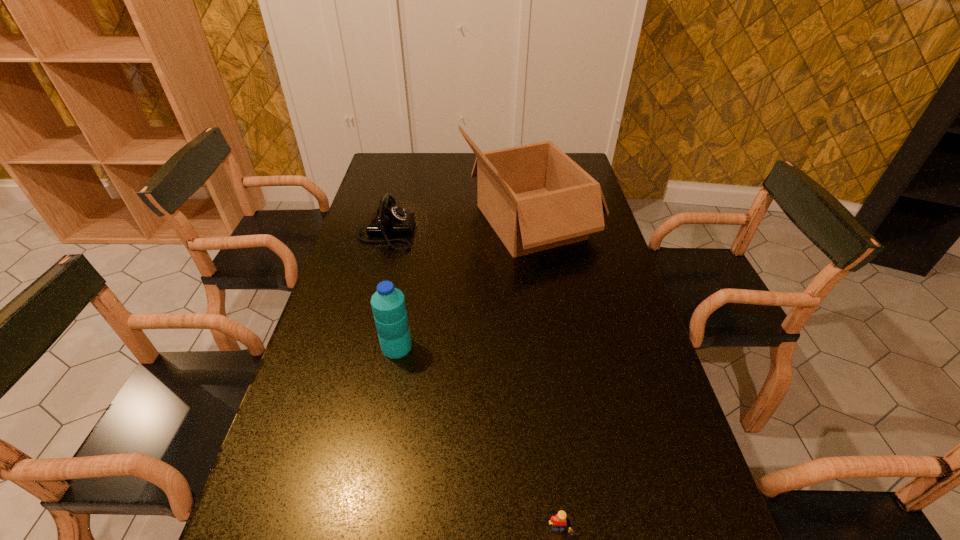
In the image, there is a desktop. Where is `blank space at the left edge`? blank space at the left edge is located at coordinates (349, 353).

Identify the location of vacant space at the right edge of the desktop. This screenshot has height=540, width=960. (662, 379).

At what (x,y) coordinates should I click in order to perform the action: click on vacant space at the far left corner of the desktop. Please return your answer as a coordinate pair (x, y). Looking at the image, I should click on point(406,156).

Identify the location of unoccupied position between the tallest object and the telephone. (458, 227).

Find the location of a particular element. The height and width of the screenshot is (540, 960). free space between the second shortest object and the box is located at coordinates (458, 227).

Find the location of a particular element. The image size is (960, 540). free area in between the tallest object and the second tallest object is located at coordinates (464, 284).

Locate an element on the screen. free space between the tallest object and the second nearest object is located at coordinates (464, 284).

Locate an element on the screen. The height and width of the screenshot is (540, 960). object that is the second closest one to the nearest object is located at coordinates (535, 197).

Locate which object ranks third in proximity to the box. Please provide its 2D coordinates. Your answer should be formatted as a tuple, i.e. [(x, y)], where the tuple contains the x and y coordinates of a point satisfying the conditions above.

[(559, 521)]

The width and height of the screenshot is (960, 540). In order to click on free location that satisfies the following two spatial constraints: 1. on the front side of the tallest object; 2. on the dial of the third tallest object in this screenshot , I will do `click(532, 233)`.